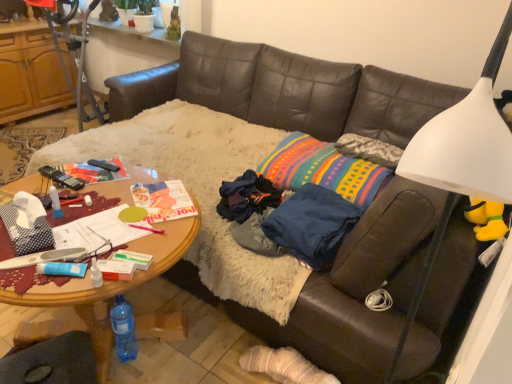
Question: From the image's perspective, relative to multicolored woven pillow at center, is brown leather couch at center above or below?

Choices:
 (A) below
 (B) above

Answer: (B)

Question: Would you say brown leather couch at center is to the left or to the right of multicolored woven pillow at center in the picture?

Choices:
 (A) right
 (B) left

Answer: (B)

Question: Which object is positioned farthest from the white plastic lampshade at upper right?

Choices:
 (A) woodendesk at center
 (B) brown leather couch at center
 (C) black leather swivel chair at lower left
 (D) multicolored woven pillow at center
 (E) dark blue fabric at center

Answer: (B)

Question: Based on their relative distances, which object is farther from the black plastic remote control at center?

Choices:
 (A) brown leather couch at center
 (B) dark blue fabric at center
 (C) multicolored woven pillow at center
 (D) white plastic lampshade at upper right
 (E) black leather swivel chair at lower left

Answer: (D)